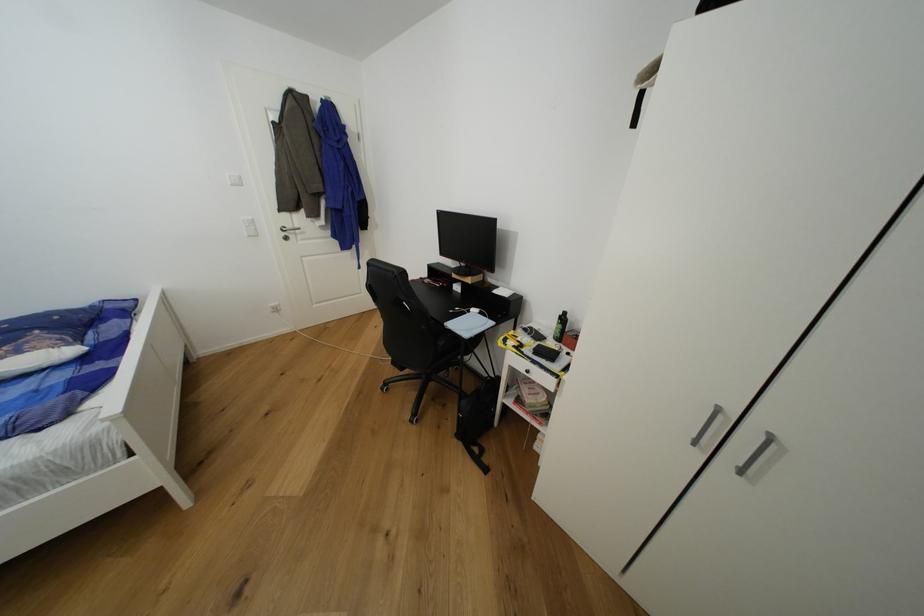
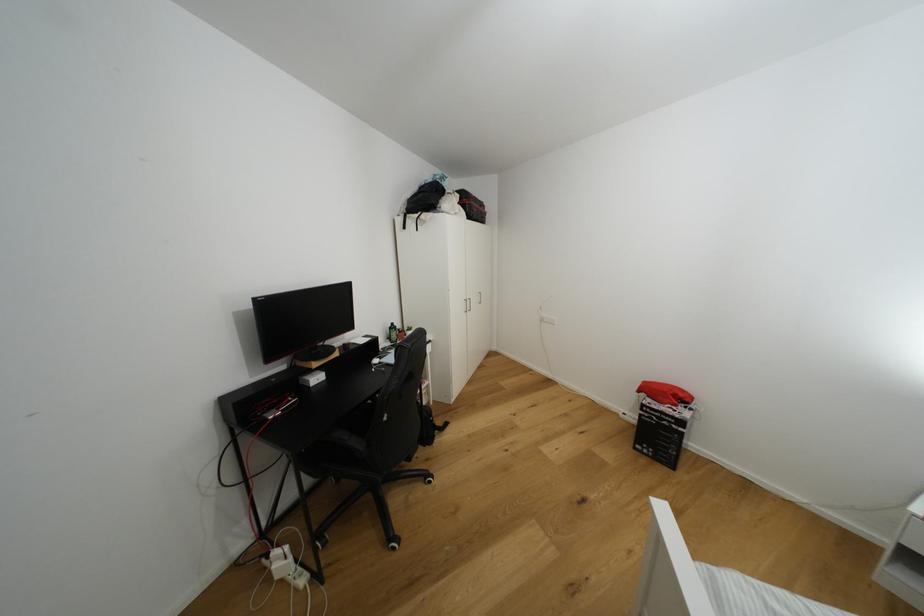
In the second image, find the point that corresponds to [565,318] in the first image.

(395, 330)